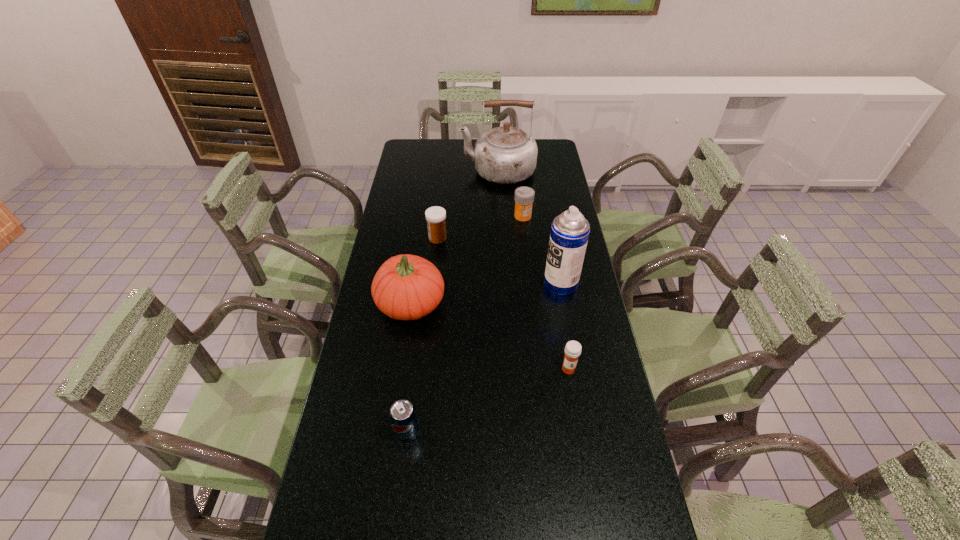
Where is `free area in between the rightmost medicine and the kettle`? Image resolution: width=960 pixels, height=540 pixels. free area in between the rightmost medicine and the kettle is located at coordinates (533, 271).

At what (x,y) coordinates should I click in order to perform the action: click on the fourth closest object to the third tallest object. Please return your answer as a coordinate pair (x, y). The width and height of the screenshot is (960, 540). Looking at the image, I should click on tap(573, 348).

Choose which object is the nearest neighbor to the kettle. Please provide its 2D coordinates. Your answer should be formatted as a tuple, i.e. [(x, y)], where the tuple contains the x and y coordinates of a point satisfying the conditions above.

[(524, 196)]

What are the coordinates of `medicine that is the second closest to the soda can` in the screenshot? It's located at (436, 216).

Find the location of a particular element. The image size is (960, 540). the second closest medicine to the nearest medicine is located at coordinates (524, 196).

The image size is (960, 540). I want to click on vacant space that satisfies the following two spatial constraints: 1. on the front side of the soda can; 2. on the right side of the pumpkin, so click(x=392, y=432).